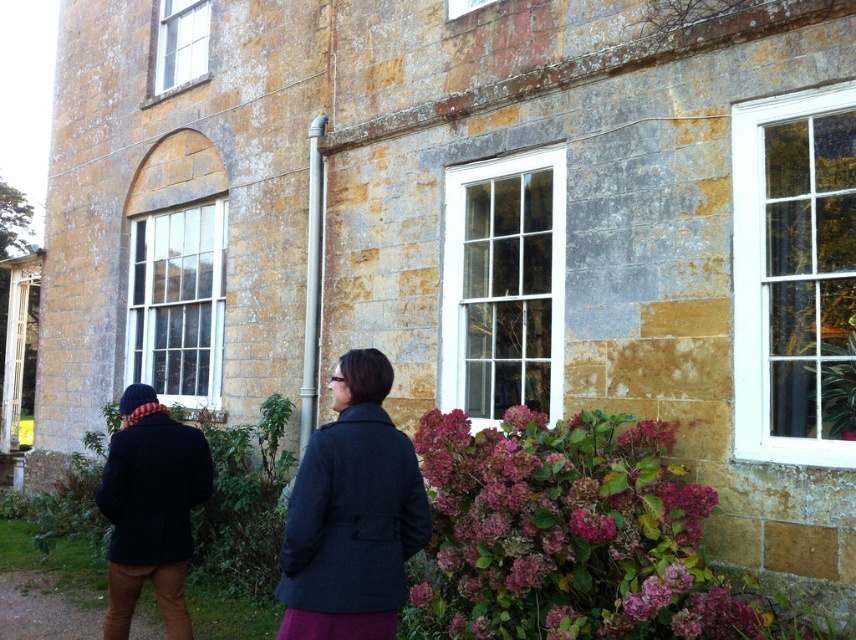
Which is more to the left, white painted wood window at right or clear glass window at center?

From the viewer's perspective, clear glass window at center appears more on the left side.

Does white painted wood window at right appear under clear glass window at center?

Correct, white painted wood window at right is located below clear glass window at center.

Is point (824, 305) positioned before point (198, 227)?

Yes.

I want to click on white painted wood window at right, so click(x=794, y=273).

Is purple matte hydrangea at lower center to the left of white painted wood window at right from the viewer's perspective?

Correct, you'll find purple matte hydrangea at lower center to the left of white painted wood window at right.

What do you see at coordinates (566, 532) in the screenshot?
I see `purple matte hydrangea at lower center` at bounding box center [566, 532].

Identify the location of purple matte hydrangea at lower center. Image resolution: width=856 pixels, height=640 pixels. (566, 532).

Does white glass window at center have a smaller size compared to clear glass window at upper left?

No, white glass window at center is not smaller than clear glass window at upper left.

Which is behind, point (520, 186) or point (185, 44)?

Positioned behind is point (185, 44).

Image resolution: width=856 pixels, height=640 pixels. What do you see at coordinates (503, 285) in the screenshot?
I see `white glass window at center` at bounding box center [503, 285].

Locate an element on the screen. white glass window at center is located at coordinates (503, 285).